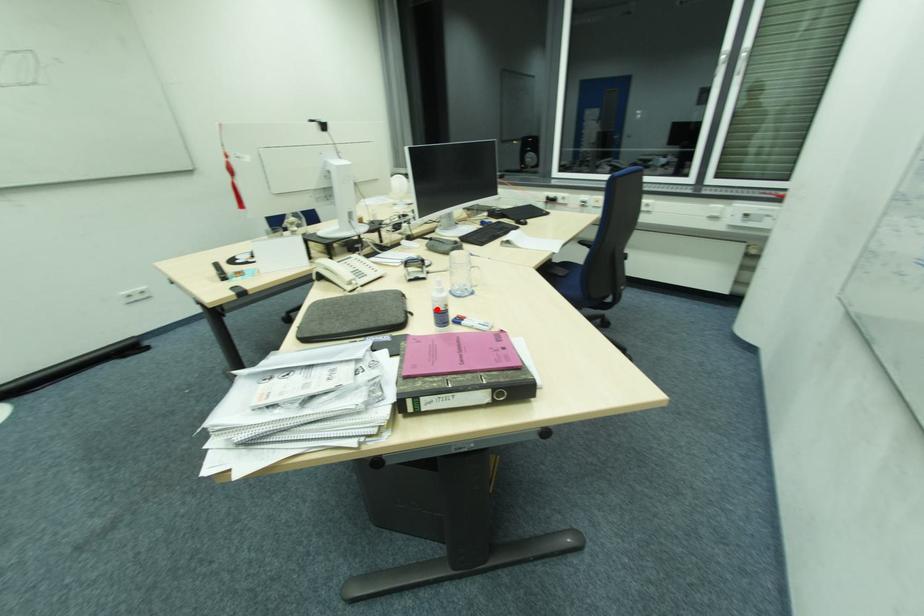
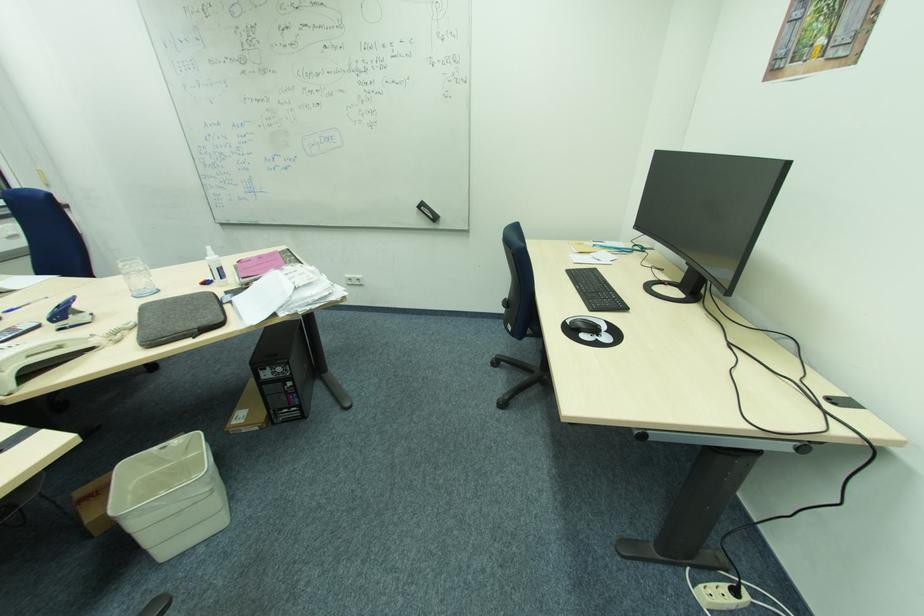
Locate, in the second image, the point that corresponds to the highlighted location in the first image.

(221, 268)